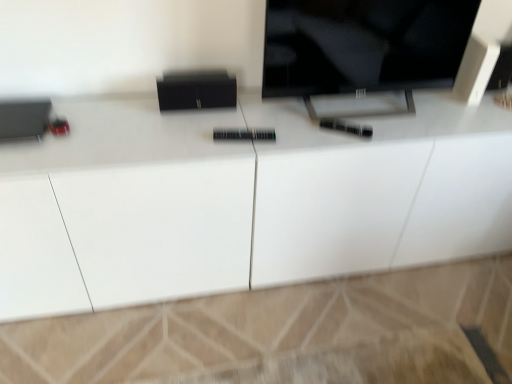
Identify the location of free point above white glossy cabinet at center (from a real-world perspective). This screenshot has width=512, height=384. (218, 127).